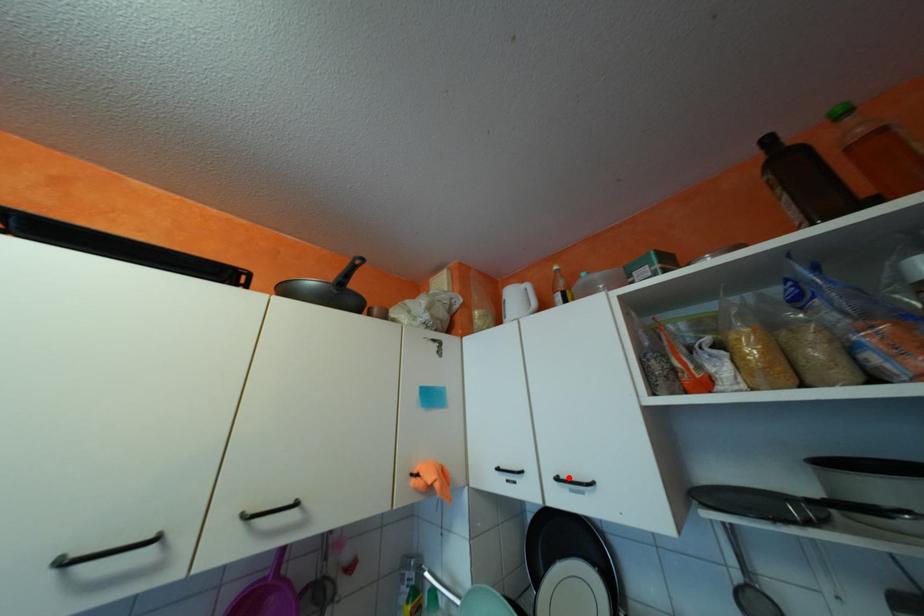
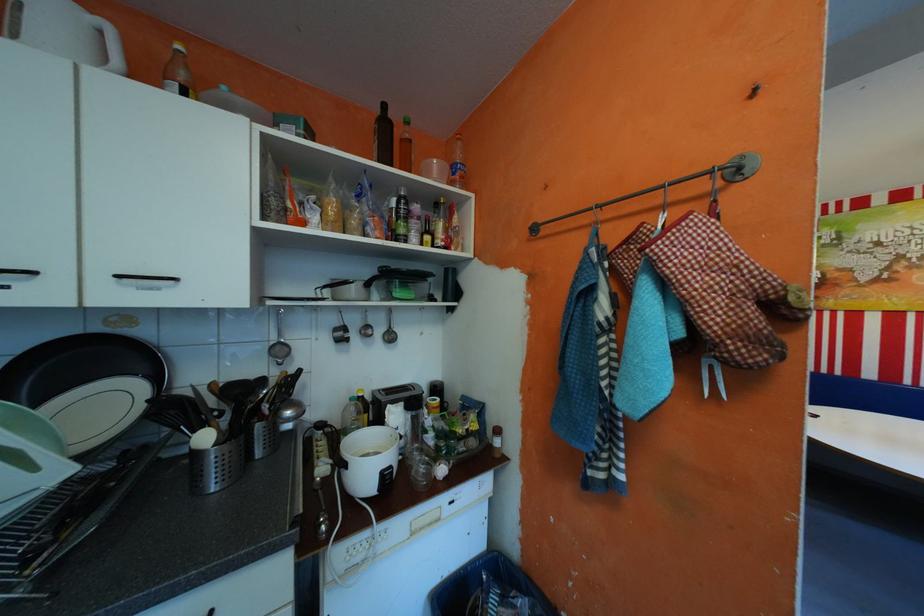
The point at the highlighted location is marked in the first image. Where is the corresponding point in the second image?

(130, 275)